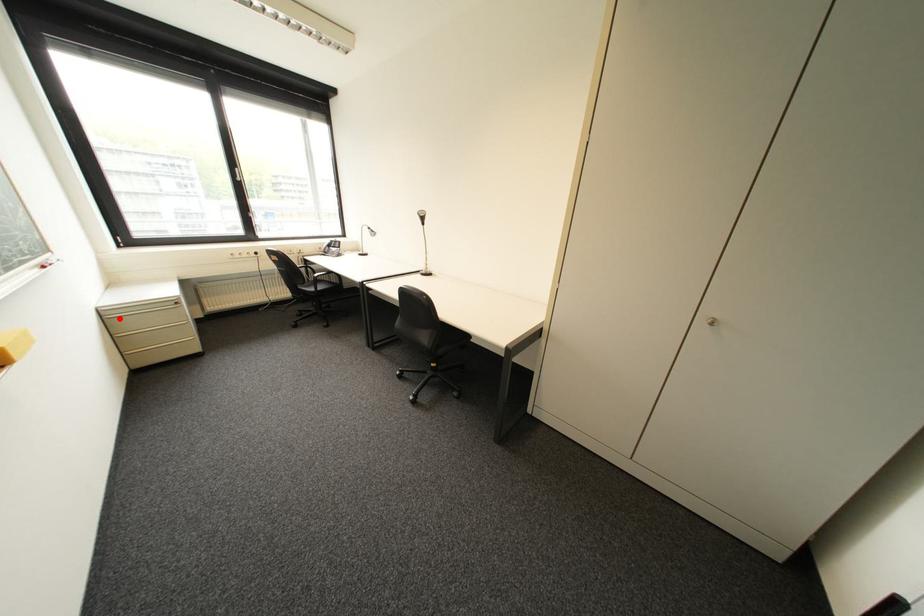
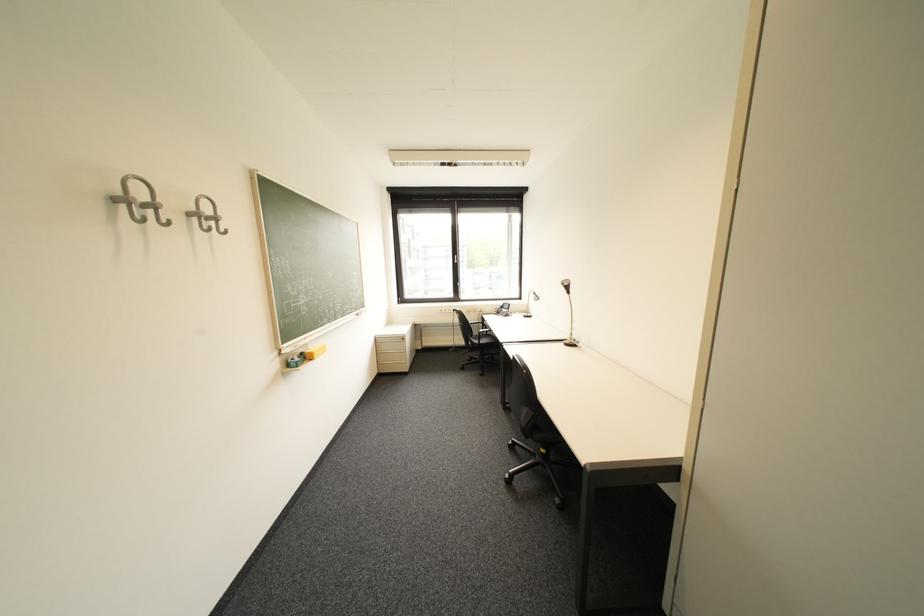
Question: I am providing you with two images of the same scene from different viewpoints. Given a red point in image1, look at the same physical point in image2. Is it:

Choices:
 (A) Closer to the viewpoint
 (B) Farther from the viewpoint

Answer: (B)